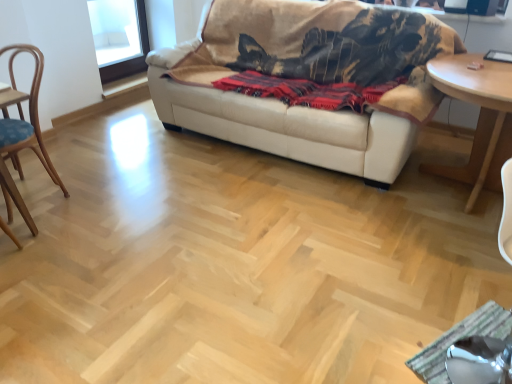
Where is `empty space that is in between wooden chair at left and light brown wooden table at right`? empty space that is in between wooden chair at left and light brown wooden table at right is located at coordinates tap(229, 194).